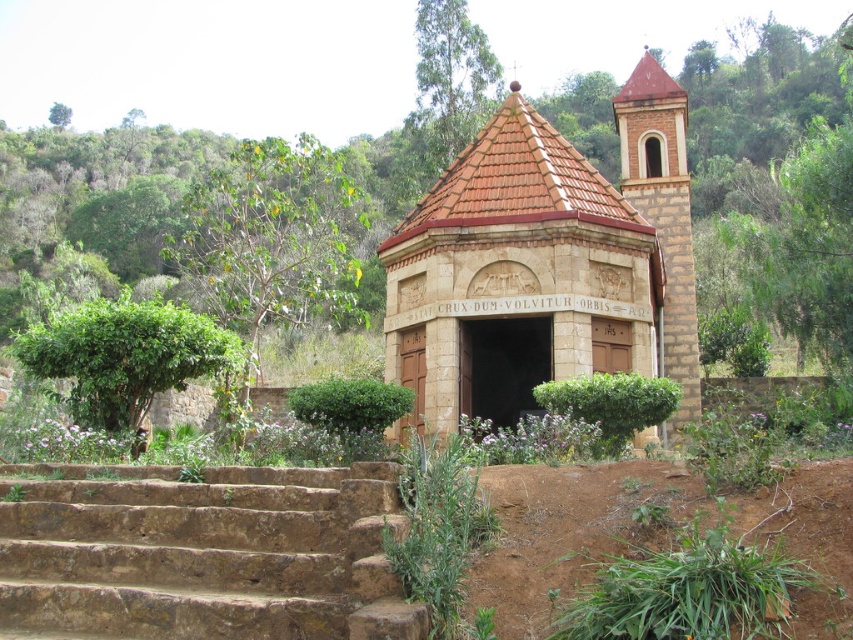
Does point (496, 92) lie behind point (68, 120)?

No, (496, 92) is closer to viewer.

Does green leafy tree at upper center have a greater width compared to green leafy tree at upper left?

In fact, green leafy tree at upper center might be narrower than green leafy tree at upper left.

Locate an element on the screen. This screenshot has width=853, height=640. green leafy tree at upper center is located at coordinates (450, 81).

Who is positioned more to the left, green leafy bush at left or green leafy tree at upper center?

From the viewer's perspective, green leafy bush at left appears more on the left side.

Is green leafy bush at left to the right of green leafy tree at upper center from the viewer's perspective?

No, green leafy bush at left is not to the right of green leafy tree at upper center.

Identify the location of green leafy bush at left. The width and height of the screenshot is (853, 640). (125, 356).

This screenshot has width=853, height=640. Describe the element at coordinates (125, 356) in the screenshot. I see `green leafy bush at left` at that location.

Which is in front, point (172, 372) or point (68, 122)?

Positioned in front is point (172, 372).

What are the coordinates of `green leafy bush at left` in the screenshot? It's located at (125, 356).